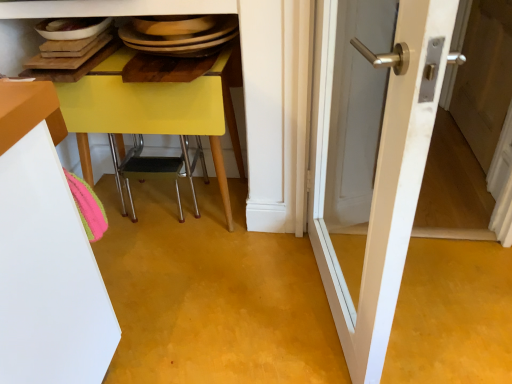
This screenshot has width=512, height=384. Identify the location of free space underneath white glossy door at center (from a real-world perspective). (327, 310).